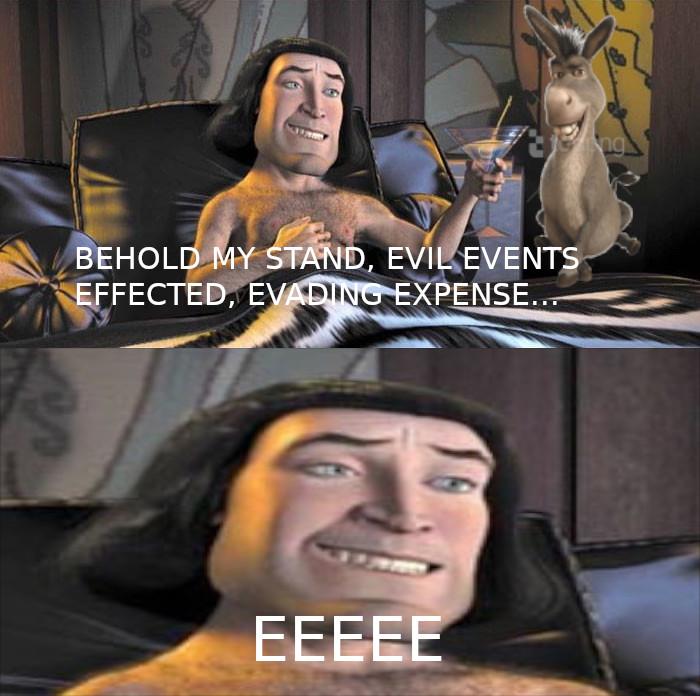
At what (x,y) coordinates should I click in order to perform the action: click on glass. Please return your answer as a coordinate pair (x, y). Looking at the image, I should click on (486, 132).